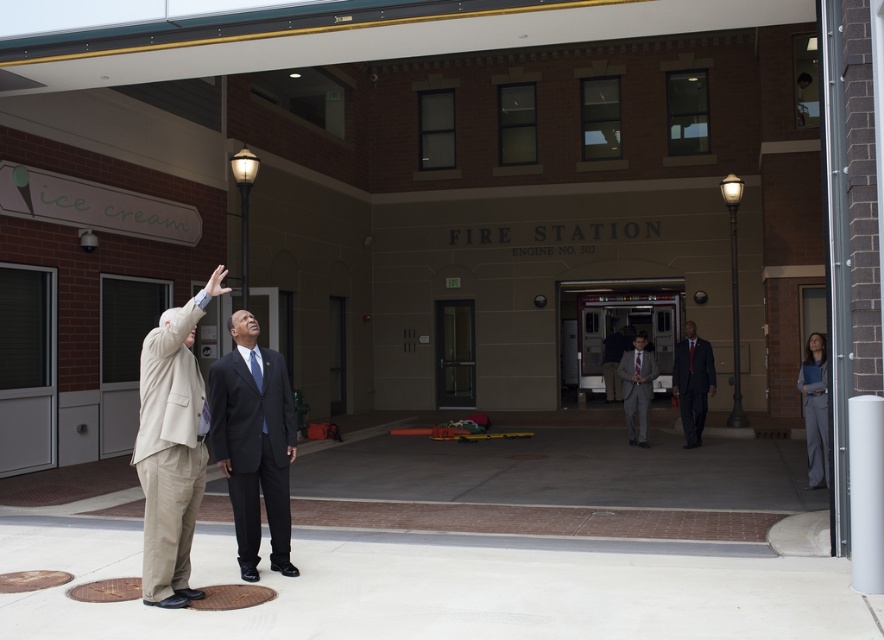
Which is below, black matte suit at center or gray suit at center?

Positioned lower is gray suit at center.

Describe the element at coordinates (253, 442) in the screenshot. I see `black matte suit at center` at that location.

Is point (275, 422) farther from camera compared to point (629, 392)?

No, (275, 422) is in front of (629, 392).

Locate an element on the screen. The image size is (884, 640). black matte suit at center is located at coordinates (253, 442).

Does beige fabric suit at lower left come in front of gray suit at center?

Yes, it is.

How far apart are beige fabric suit at lower left and gray suit at center?

A distance of 34.26 feet exists between beige fabric suit at lower left and gray suit at center.

The image size is (884, 640). What do you see at coordinates (171, 448) in the screenshot?
I see `beige fabric suit at lower left` at bounding box center [171, 448].

The image size is (884, 640). I want to click on beige fabric suit at lower left, so click(171, 448).

Between beige fabric suit at lower left and black matte suit at center, which one appears on the right side from the viewer's perspective?

Positioned to the right is black matte suit at center.

Between beige fabric suit at lower left and black matte suit at center, which one is positioned higher?

beige fabric suit at lower left is higher up.

Which is behind, point (159, 396) or point (231, 444)?

Point (231, 444)

Image resolution: width=884 pixels, height=640 pixels. In order to click on beige fabric suit at lower left in this screenshot , I will do `click(171, 448)`.